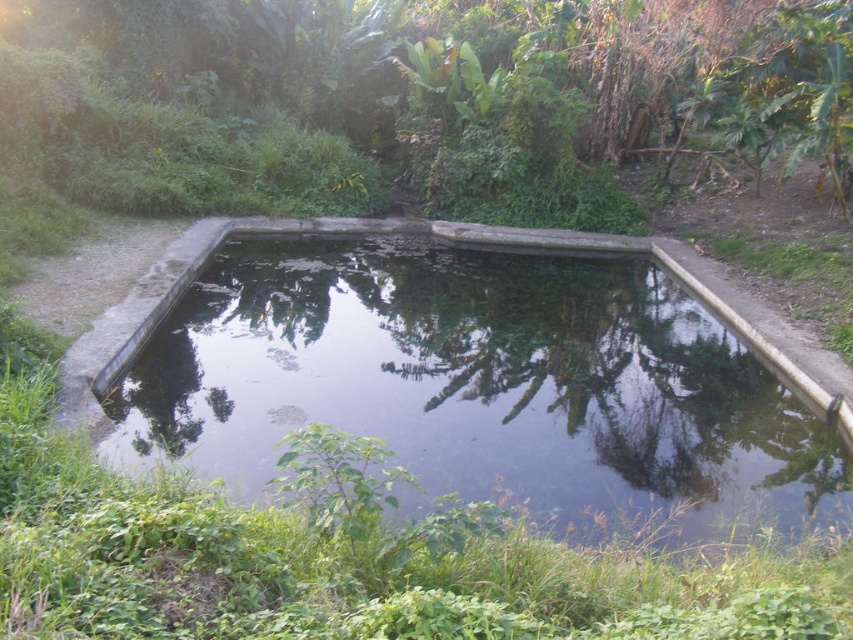
Which of these two, green leafy tree at center or concrete pond at center, stands taller?

Standing taller between the two is green leafy tree at center.

Does green leafy tree at center appear over concrete pond at center?

Indeed, green leafy tree at center is positioned over concrete pond at center.

Describe the element at coordinates (418, 100) in the screenshot. I see `green leafy tree at center` at that location.

Where is `green leafy tree at center`? This screenshot has width=853, height=640. green leafy tree at center is located at coordinates (418, 100).